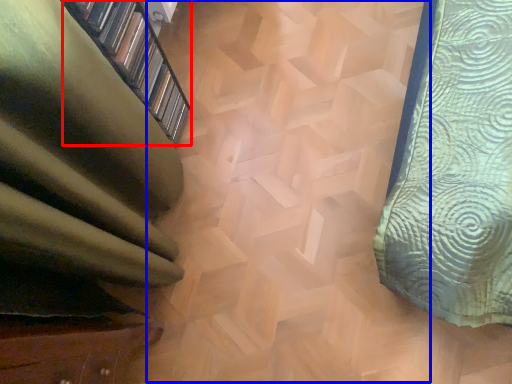
Question: Which point is further to the camera, shelf (highlighted by a red box) or stairwell (highlighted by a blue box)?

Choices:
 (A) shelf
 (B) stairwell

Answer: (B)